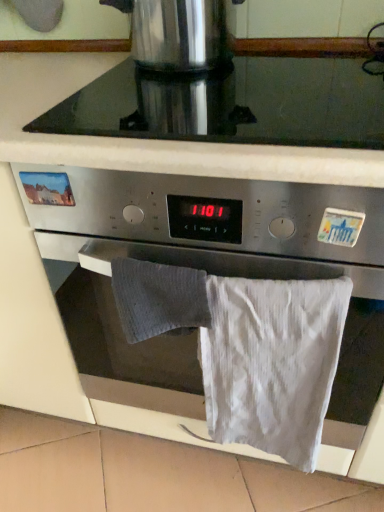
Question: Considering the relative sizes of black glass at upper center and stainless steel coffee pot at upper center in the image provided, is black glass at upper center shorter than stainless steel coffee pot at upper center?

Choices:
 (A) no
 (B) yes

Answer: (B)

Question: Does black glass at upper center turn towards stainless steel coffee pot at upper center?

Choices:
 (A) no
 (B) yes

Answer: (A)

Question: From a real-world perspective, is black glass at upper center over stainless steel coffee pot at upper center?

Choices:
 (A) yes
 (B) no

Answer: (B)

Question: Is black glass at upper center looking in the opposite direction of stainless steel coffee pot at upper center?

Choices:
 (A) no
 (B) yes

Answer: (A)

Question: Is black glass at upper center completely or partially outside of stainless steel coffee pot at upper center?

Choices:
 (A) no
 (B) yes

Answer: (B)

Question: Considering the relative sizes of black glass at upper center and stainless steel coffee pot at upper center in the image provided, is black glass at upper center taller than stainless steel coffee pot at upper center?

Choices:
 (A) no
 (B) yes

Answer: (A)

Question: Is black glass at upper center with satin silver oven at center?

Choices:
 (A) no
 (B) yes

Answer: (A)

Question: Does black glass at upper center appear on the left side of satin silver oven at center?

Choices:
 (A) no
 (B) yes

Answer: (B)

Question: From a real-world perspective, is black glass at upper center under satin silver oven at center?

Choices:
 (A) no
 (B) yes

Answer: (A)

Question: Is black glass at upper center facing towards satin silver oven at center?

Choices:
 (A) no
 (B) yes

Answer: (A)

Question: Is black glass at upper center positioned with its back to satin silver oven at center?

Choices:
 (A) no
 (B) yes

Answer: (A)

Question: From the image's perspective, is black glass at upper center over satin silver oven at center?

Choices:
 (A) yes
 (B) no

Answer: (A)

Question: Is stainless steel coffee pot at upper center with satin silver oven at center?

Choices:
 (A) no
 (B) yes

Answer: (A)